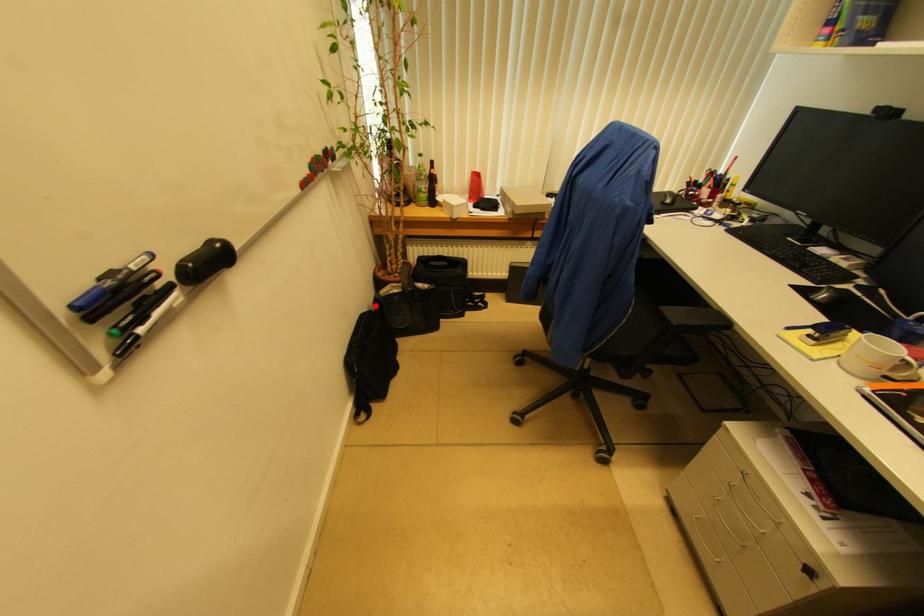
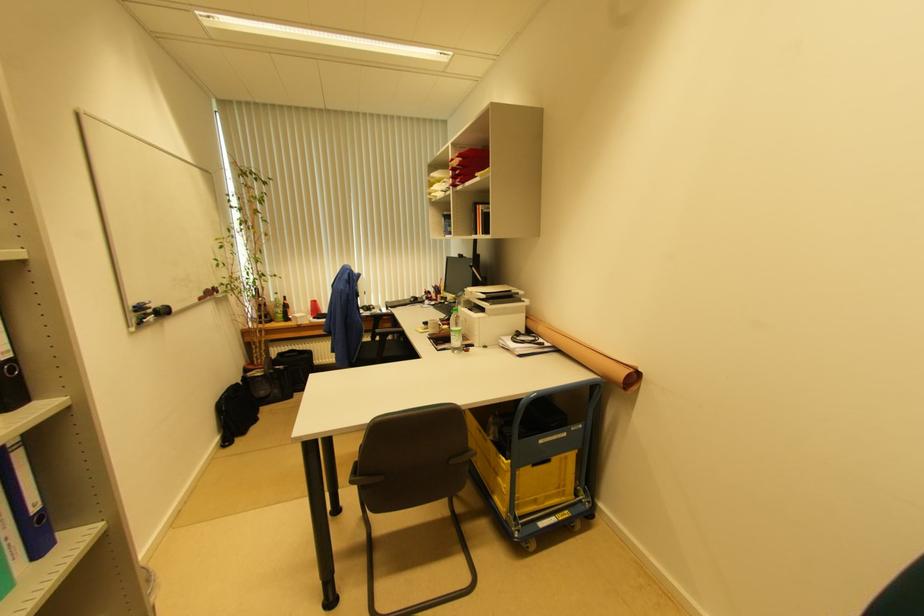
Find the pixel in the second image that matches the highlighted location in the first image.

(242, 383)